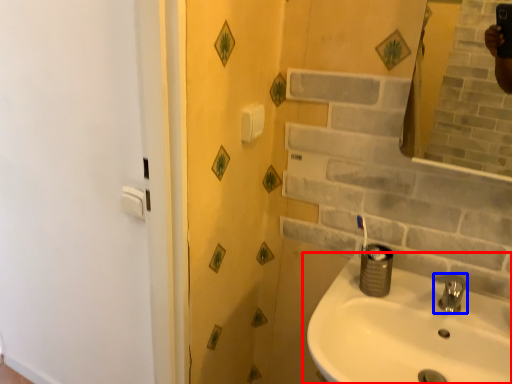
Question: Which point is closer to the camera, sink (highlighted by a red box) or tap (highlighted by a blue box)?

Choices:
 (A) sink
 (B) tap

Answer: (A)